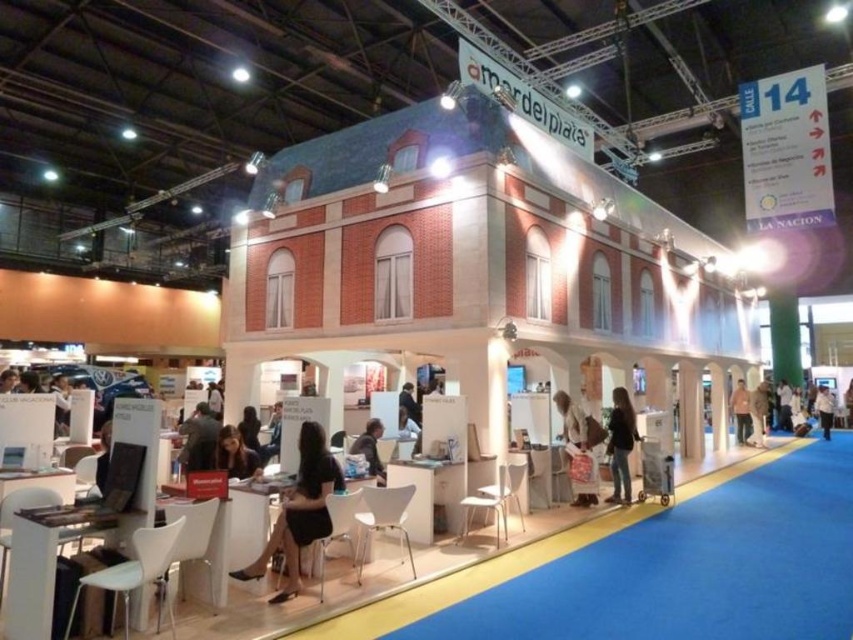
Does matte black shirt at center have a larger size compared to brown leather jacket at center?

Incorrect, matte black shirt at center is not larger than brown leather jacket at center.

Who is higher up, matte black shirt at center or brown leather jacket at center?

matte black shirt at center is higher up.

Between point (376, 467) and point (761, 404), which one is positioned in front?

Point (376, 467) is in front.

Locate an element on the screen. matte black shirt at center is located at coordinates (370, 449).

Does brown leather jacket at center appear on the right side of dark brown leather jacket at center?

Indeed, brown leather jacket at center is positioned on the right side of dark brown leather jacket at center.

Can you confirm if brown leather jacket at center is bigger than dark brown leather jacket at center?

Correct, brown leather jacket at center is larger in size than dark brown leather jacket at center.

Is point (759, 412) farther from camera compared to point (250, 426)?

Yes, it is.

Locate an element on the screen. This screenshot has width=853, height=640. brown leather jacket at center is located at coordinates (758, 413).

Which is below, brown leather jacket at lower right or white fabric shirt at center?

white fabric shirt at center

How distant is brown leather jacket at lower right from white fabric shirt at center?

The distance of brown leather jacket at lower right from white fabric shirt at center is 4.39 meters.

Is point (735, 397) positioned behind point (827, 436)?

That is False.

This screenshot has width=853, height=640. I want to click on brown leather jacket at lower right, so (x=741, y=410).